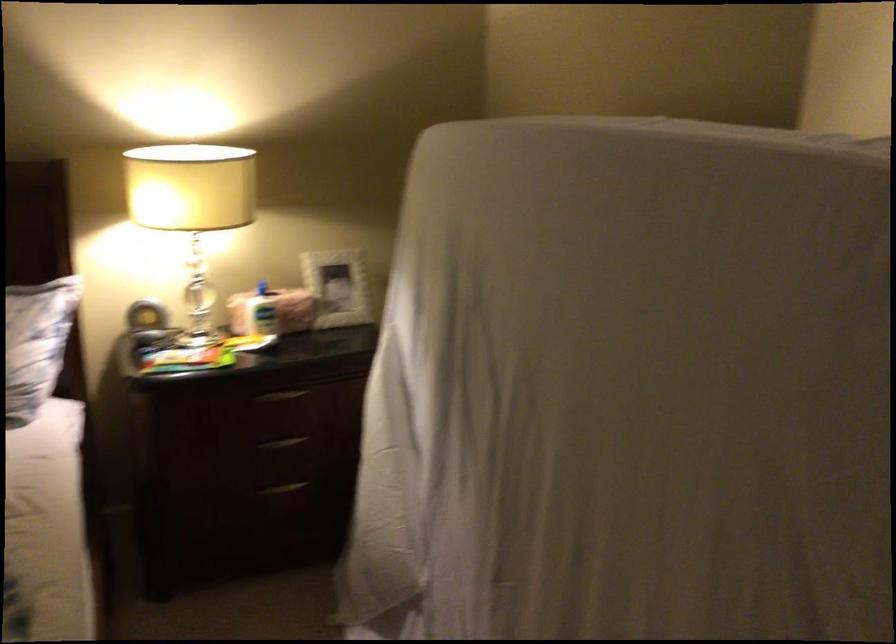
Identify the location of lotion pump top. This screenshot has width=896, height=644. (262, 288).